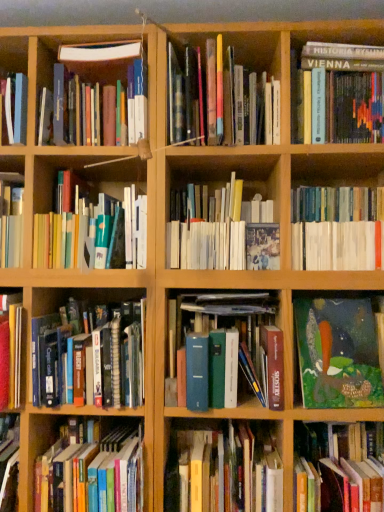
Question: From their relative heights in the image, would you say green matte book at lower right, the 3th book when ordered from bottom to top, is taller or shorter than hardcover book at lower left, which is the second book in bottom-to-top order?

Choices:
 (A) tall
 (B) short

Answer: (A)

Question: Which is correct: green matte book at lower right, the tenth book viewed from the top, is inside hardcover book at lower left, the 11th book positioned from the top, or outside of it?

Choices:
 (A) inside
 (B) outside

Answer: (B)

Question: Which object is the farthest from the hardcover book at upper right, which is counted as the 10th book, starting from the bottom?

Choices:
 (A) hardcover books at center left, the 6th book from the bottom
 (B) hardcover book at center, positioned as the 2th book in top-to-bottom order
 (C) hardcover book at lower left, which is the second book in bottom-to-top order
 (D) hardcover book at center, which appears as the 1th book when viewed from the top
 (E) hardcover books at center, acting as the 7th book starting from the bottom

Answer: (C)

Question: Which is farther from the hardcover book at center, placed as the 12th book when sorted from top to bottom?

Choices:
 (A) hardcover book at upper right, which ranks as the third book in top-to-bottom order
 (B) hardcover book at lower left, the 11th book positioned from the top
 (C) blue hardcover book at center, which ranks as the 4th book in bottom-to-top order
 (D) green matte book at lower right, the tenth book viewed from the top
 (E) hardcover book at center, which appears as the 1th book when viewed from the top

Answer: (A)